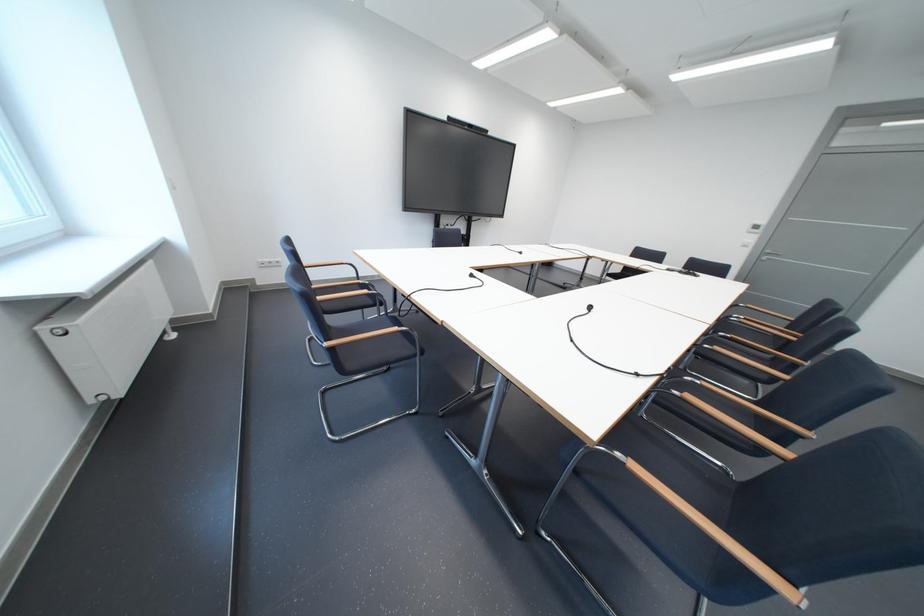
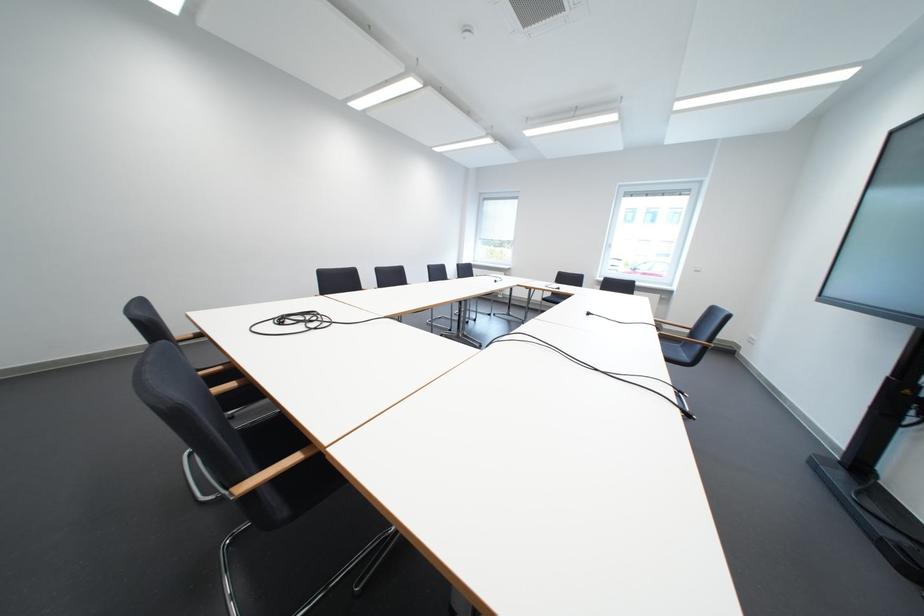
In the second image, find the point that corresponds to pixel 532 254 in the first image.

(601, 315)